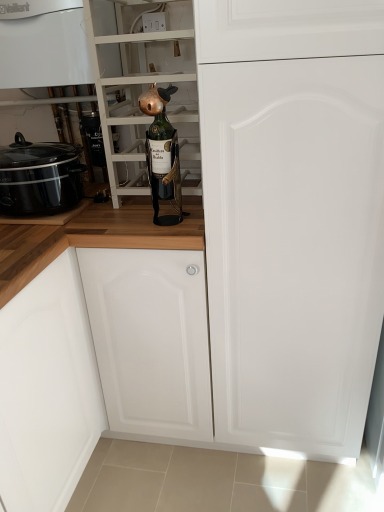
Question: From a real-world perspective, is green glass bottle at center on top of green glass bottle at center?

Choices:
 (A) no
 (B) yes

Answer: (A)

Question: Is green glass bottle at center not inside green glass bottle at center?

Choices:
 (A) yes
 (B) no

Answer: (A)

Question: Is green glass bottle at center bigger than green glass bottle at center?

Choices:
 (A) yes
 (B) no

Answer: (B)

Question: Is green glass bottle at center not close to green glass bottle at center?

Choices:
 (A) no
 (B) yes

Answer: (A)

Question: From the image's perspective, does green glass bottle at center appear lower than green glass bottle at center?

Choices:
 (A) no
 (B) yes

Answer: (B)

Question: Could you tell me if green glass bottle at center is turned towards green glass bottle at center?

Choices:
 (A) yes
 (B) no

Answer: (B)

Question: Is green glass bottle at center bigger than white glossy boiler at upper left?

Choices:
 (A) yes
 (B) no

Answer: (B)

Question: Considering the relative sizes of green glass bottle at center and white glossy boiler at upper left in the image provided, is green glass bottle at center shorter than white glossy boiler at upper left?

Choices:
 (A) no
 (B) yes

Answer: (A)

Question: Does green glass bottle at center have a greater width compared to white glossy boiler at upper left?

Choices:
 (A) no
 (B) yes

Answer: (A)

Question: Considering the relative positions of green glass bottle at center and white glossy boiler at upper left in the image provided, is green glass bottle at center to the left of white glossy boiler at upper left from the viewer's perspective?

Choices:
 (A) yes
 (B) no

Answer: (B)

Question: Can you confirm if green glass bottle at center is thinner than white glossy boiler at upper left?

Choices:
 (A) yes
 (B) no

Answer: (A)

Question: From the image's perspective, is green glass bottle at center on top of white glossy boiler at upper left?

Choices:
 (A) yes
 (B) no

Answer: (B)

Question: Can you confirm if black glossy slow cooker at left is positioned to the left of green glass bottle at center?

Choices:
 (A) no
 (B) yes

Answer: (B)